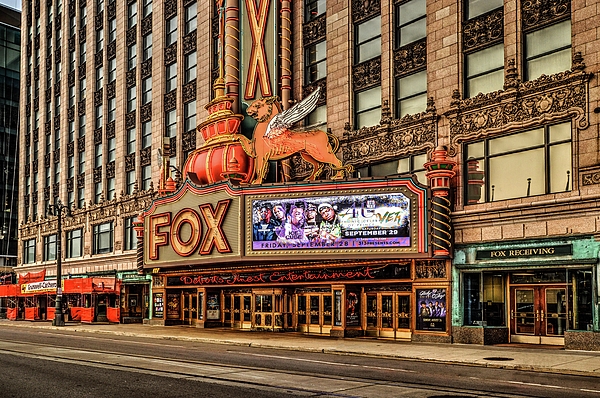
Locate an element on the screen. This screenshot has height=398, width=600. window is located at coordinates (511, 175).